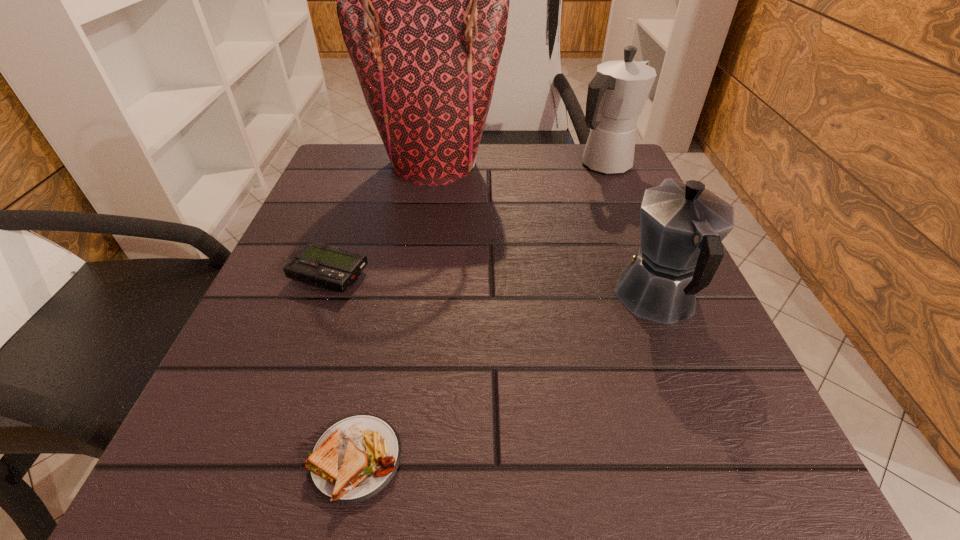
Find the location of a particular element. This screenshot has width=960, height=540. vacant area at the near right corner of the desktop is located at coordinates (685, 468).

Where is `free area in between the tallest object and the taller coffeepot`? This screenshot has height=540, width=960. free area in between the tallest object and the taller coffeepot is located at coordinates (518, 164).

The width and height of the screenshot is (960, 540). I want to click on free space between the tallest object and the nearer coffeepot, so click(546, 231).

Where is `empty location between the second shortest object and the nearer coffeepot`? This screenshot has width=960, height=540. empty location between the second shortest object and the nearer coffeepot is located at coordinates (493, 287).

You are a GUI agent. You are given a task and a screenshot of the screen. Output one action in this format:
    pyautogui.click(x=<x>, y=<y>)
    Task: Click on the vacant area between the shortest object and the beeper
    Image resolution: width=960 pixels, height=540 pixels.
    Given the screenshot: What is the action you would take?
    pyautogui.click(x=343, y=367)

Image resolution: width=960 pixels, height=540 pixels. I want to click on free area in between the tallest object and the beeper, so click(x=382, y=219).

Find the location of a particular element. vacant region between the taller coffeepot and the beeper is located at coordinates (467, 220).

Locate an element on the screen. The width and height of the screenshot is (960, 540). free space between the beeper and the nearest object is located at coordinates (343, 367).

At what (x,y) coordinates should I click in order to perform the action: click on vacant space that is in between the nearest object and the second shortest object. Please return your answer as a coordinate pair (x, y). Looking at the image, I should click on (343, 367).

The height and width of the screenshot is (540, 960). Identify the location of free point between the shortest object and the tallest object. pyautogui.click(x=396, y=311).